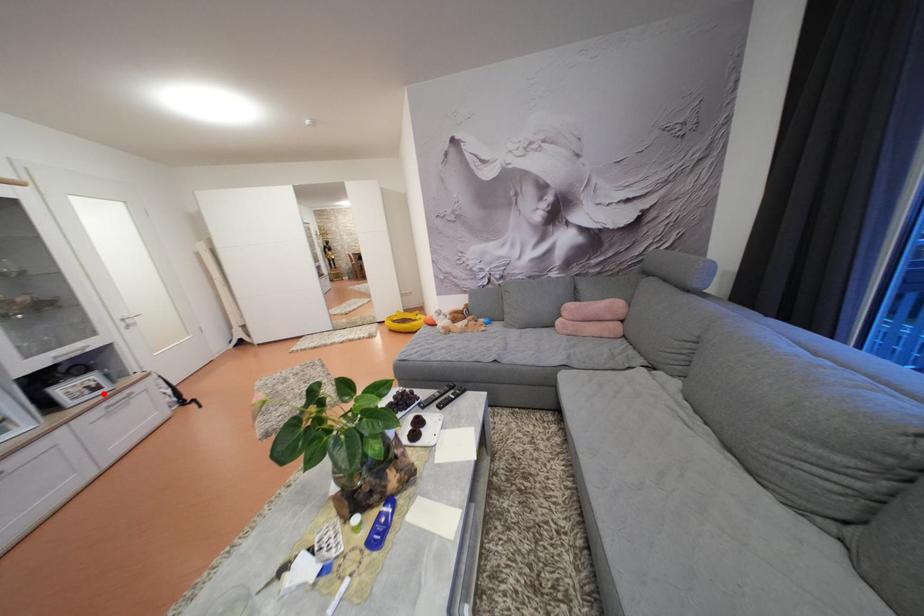
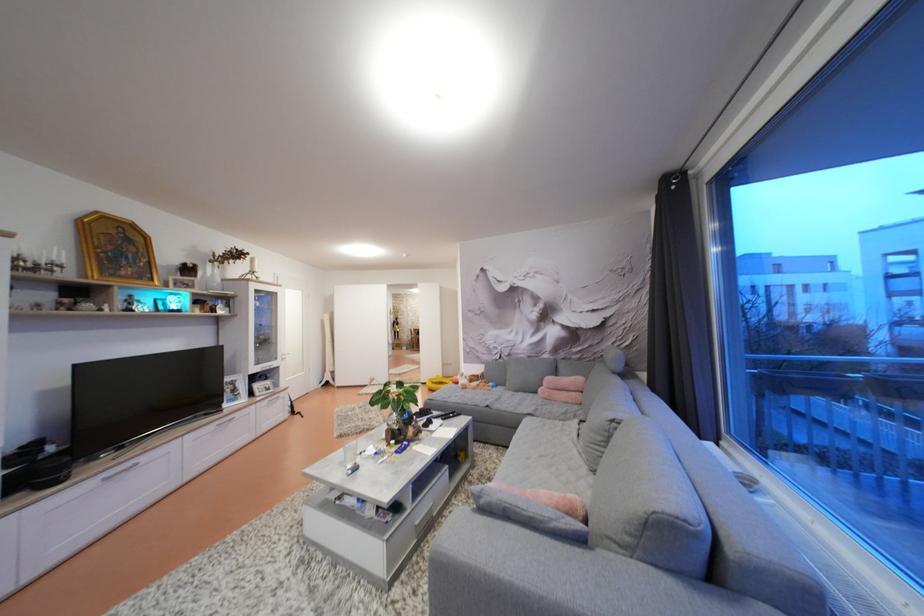
Find the pixel in the second image that matches the highlighted location in the first image.

(274, 394)